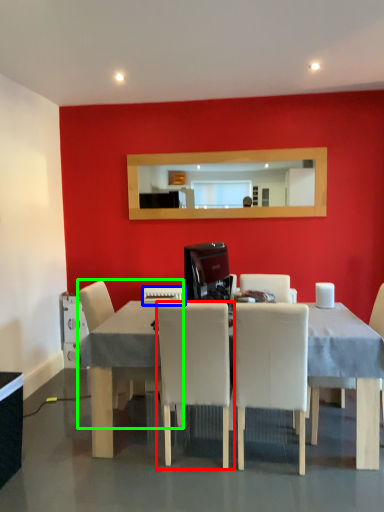
Question: Which object is the closest to the chair (highlighted by a red box)? Choose among these: appliance (highlighted by a blue box) or chair (highlighted by a green box).

Choices:
 (A) appliance
 (B) chair

Answer: (B)